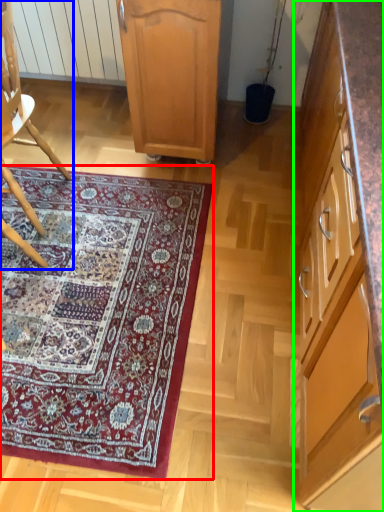
Question: Which is farther away from mat (highlighted by a red box)? chair (highlighted by a blue box) or cabinetry (highlighted by a green box)?

Choices:
 (A) chair
 (B) cabinetry

Answer: (B)